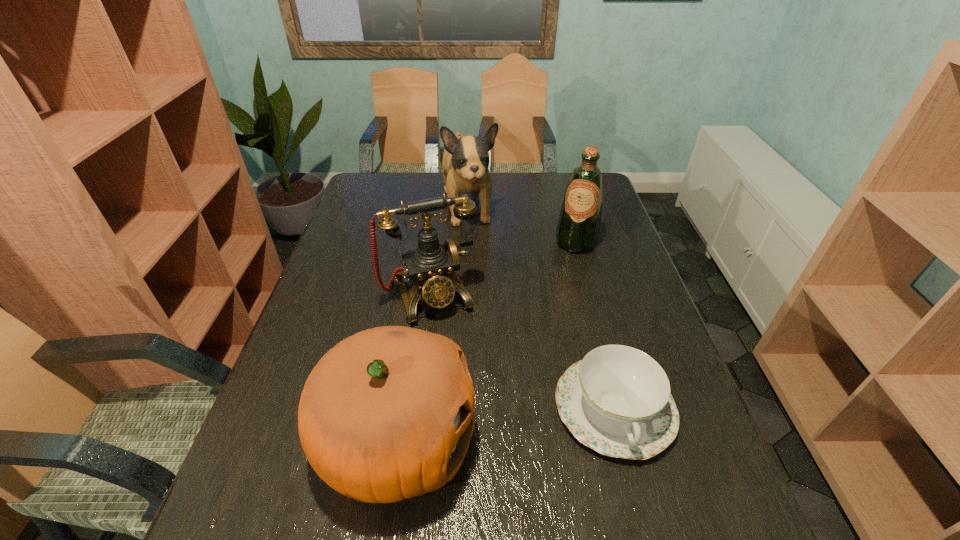
Find the location of `olive oil that is at the right edge`. olive oil that is at the right edge is located at coordinates [x=578, y=227].

Locate an element on the screen. The height and width of the screenshot is (540, 960). object present at the near left corner is located at coordinates (387, 414).

Identify the location of object at the near right corner. The height and width of the screenshot is (540, 960). (617, 400).

What are the coordinates of `vacant space at the far edge` in the screenshot? It's located at (423, 180).

Locate an element on the screen. This screenshot has width=960, height=540. blank space at the left edge of the desktop is located at coordinates (326, 313).

At what (x,y) coordinates should I click in order to perform the action: click on free space at the right edge. Please return your answer as a coordinate pair (x, y). The image size is (960, 540). Looking at the image, I should click on (619, 264).

Identify the location of blank space at the far left corner of the desktop. (372, 194).

Locate an element on the screen. This screenshot has height=540, width=960. free space at the near left corner is located at coordinates click(242, 460).

Identify the location of vacant point located between the pumpkin and the olive oil. Image resolution: width=960 pixels, height=540 pixels. point(487,342).

Identify the location of empty space between the olive oil and the pumpkin. (487, 342).